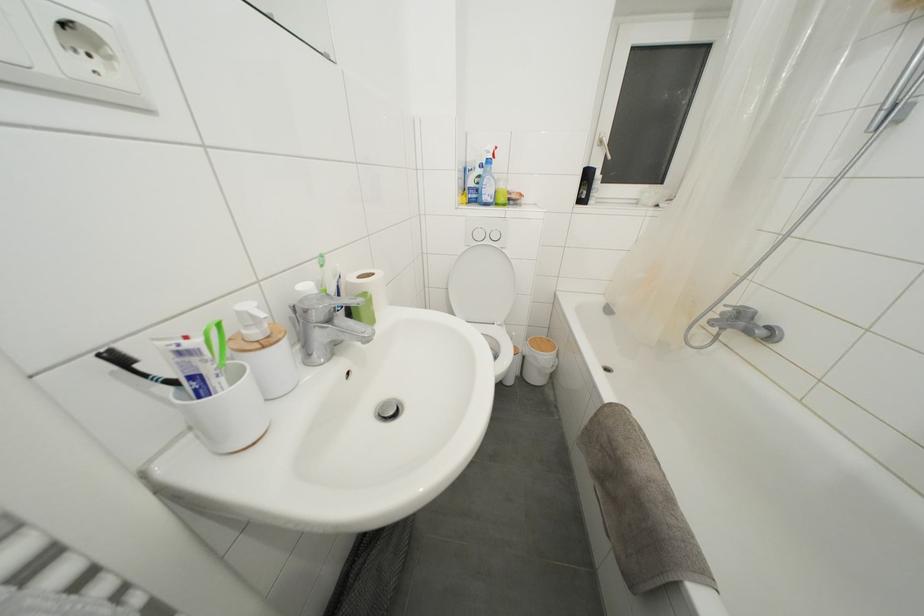
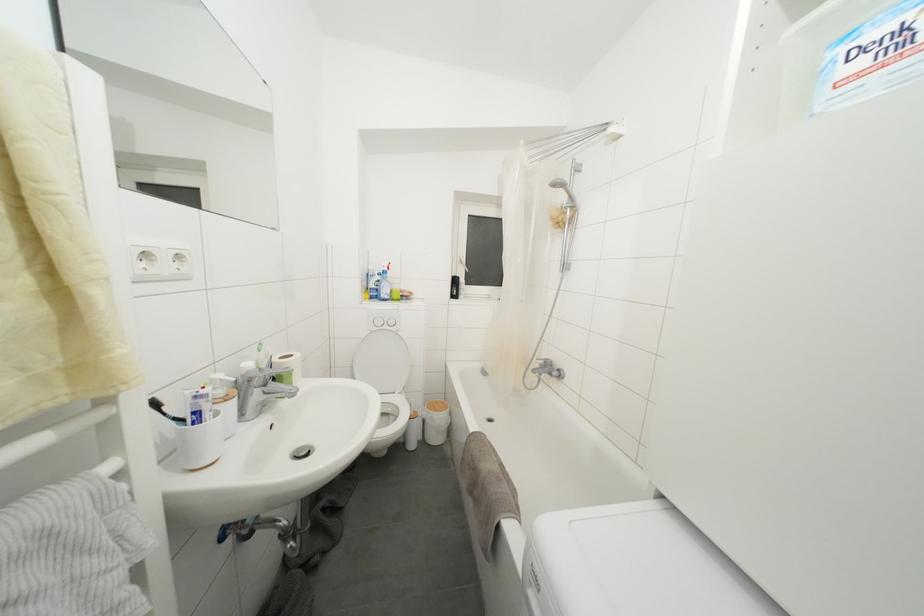
In the second image, find the point that corresponds to the point at 219,387 in the first image.

(211, 419)